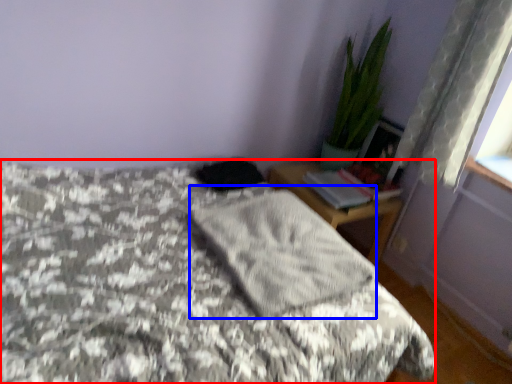
Question: Which object appears farthest to the camera in this image, bed (highlighted by a red box) or mattress (highlighted by a blue box)?

Choices:
 (A) bed
 (B) mattress

Answer: (B)